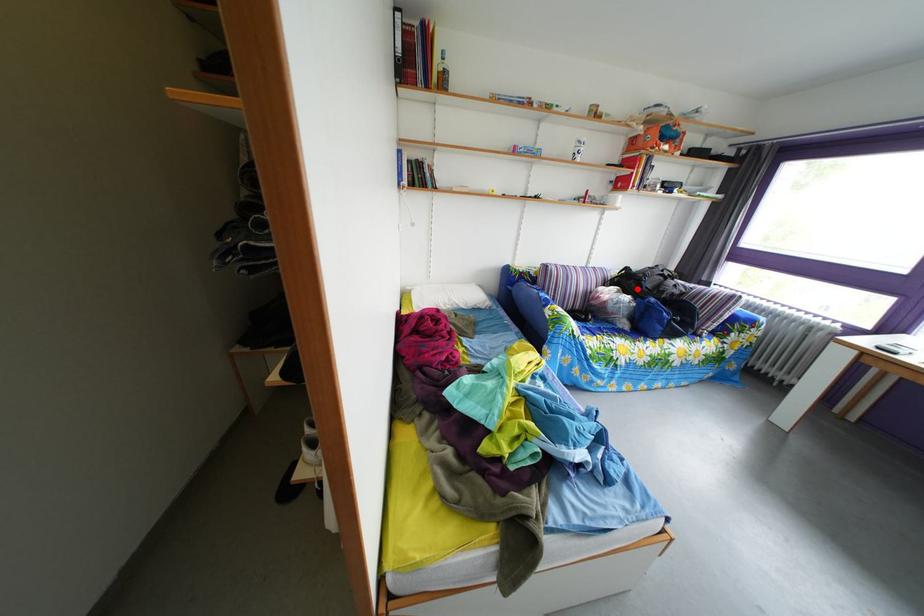
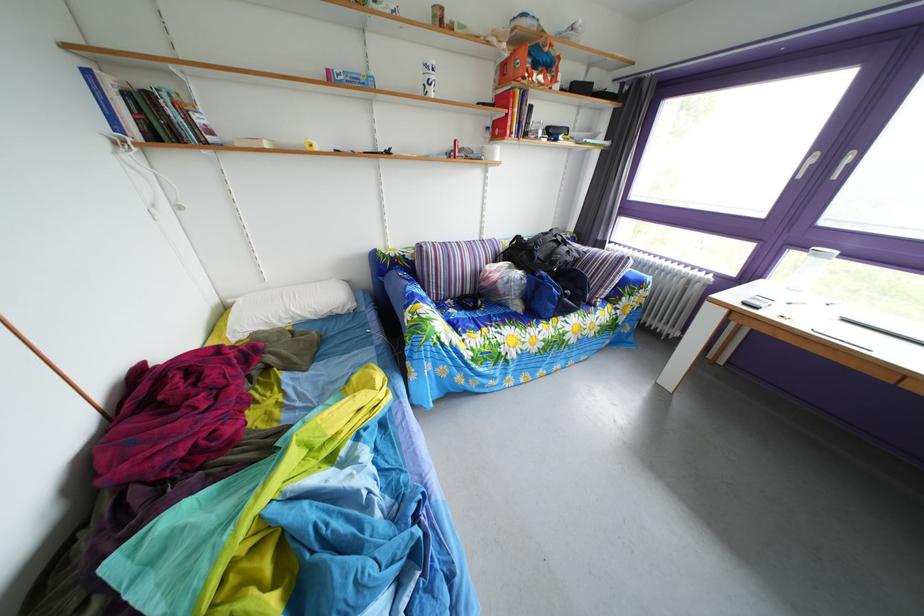
In the second image, find the point that corresponds to the highlighted location in the first image.

(529, 261)